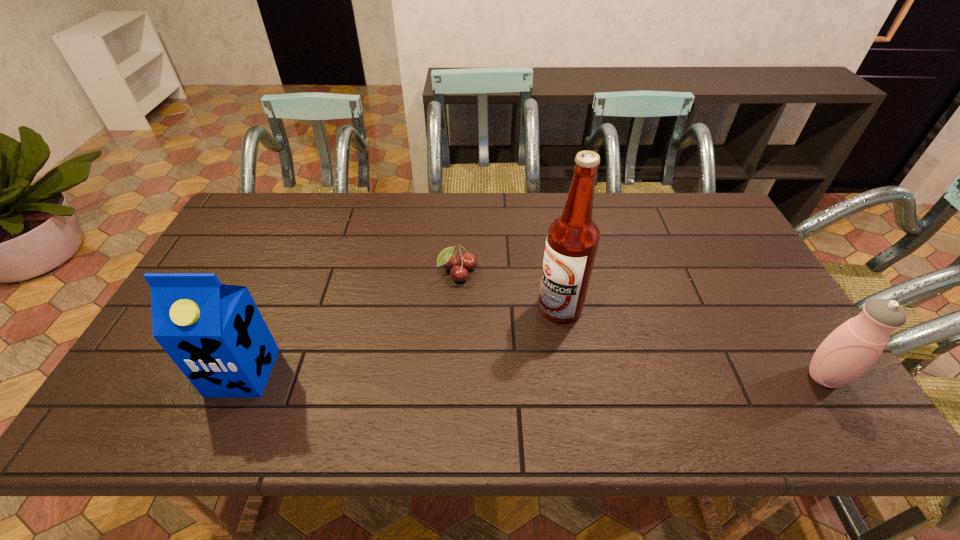
Image resolution: width=960 pixels, height=540 pixels. I want to click on free space on the desktop that is between the carton and the thermos bottle and is positioned on the label side of the tallest object, so click(x=484, y=375).

The height and width of the screenshot is (540, 960). Identify the location of free space on the desktop that is between the third shortest object and the rightmost object and is positioned on the leaves of the cherry. (554, 375).